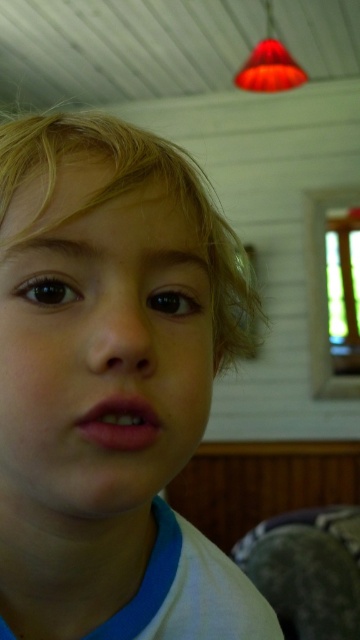
You are a photographer adjusting lighting for a portrait. You notice the smooth skin face at center and the blonde silky hair at center in your frame. Which object is positioned lower in the image?

The smooth skin face at center is positioned below the blonde silky hair at center, so the smooth skin face at center is lower in the image.

Based on the scene description, which object has a smaller size between the smooth skin face at center and the blonde silky hair at center?

The smooth skin face at center has a smaller size compared to the blonde silky hair at center.

You are a photographer trying to capture the child in the image. You need to ensure that both the smooth skin face at center and the blonde silky hair at center are visible in the frame. Based on their positions, which object should you focus on first to ensure both are in the shot?

The smooth skin face at center is to the left of blonde silky hair at center, so focusing on the smooth skin face at center first will help ensure both are in the frame since it is positioned to the left of the hair.